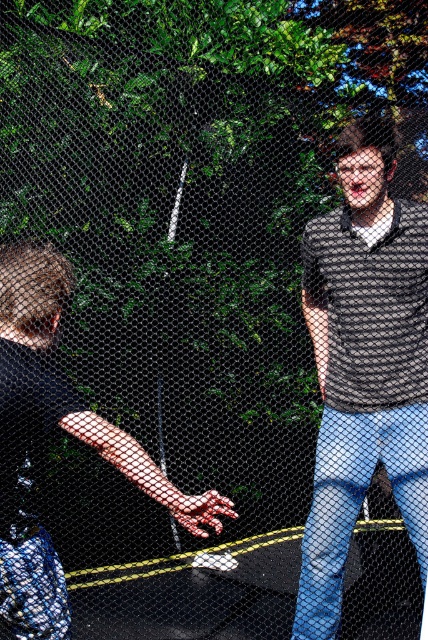
Question: Can you confirm if matte black shirt at right is positioned to the right of black matte shirt at left?

Choices:
 (A) yes
 (B) no

Answer: (A)

Question: Among these objects, which one is nearest to the camera?

Choices:
 (A) matte black shirt at right
 (B) black matte shirt at left

Answer: (B)

Question: Is matte black shirt at right to the right of black matte shirt at left from the viewer's perspective?

Choices:
 (A) no
 (B) yes

Answer: (B)

Question: Which point is closer to the camera?

Choices:
 (A) (2, 545)
 (B) (371, 432)

Answer: (A)

Question: Is matte black shirt at right behind black matte shirt at left?

Choices:
 (A) no
 (B) yes

Answer: (B)